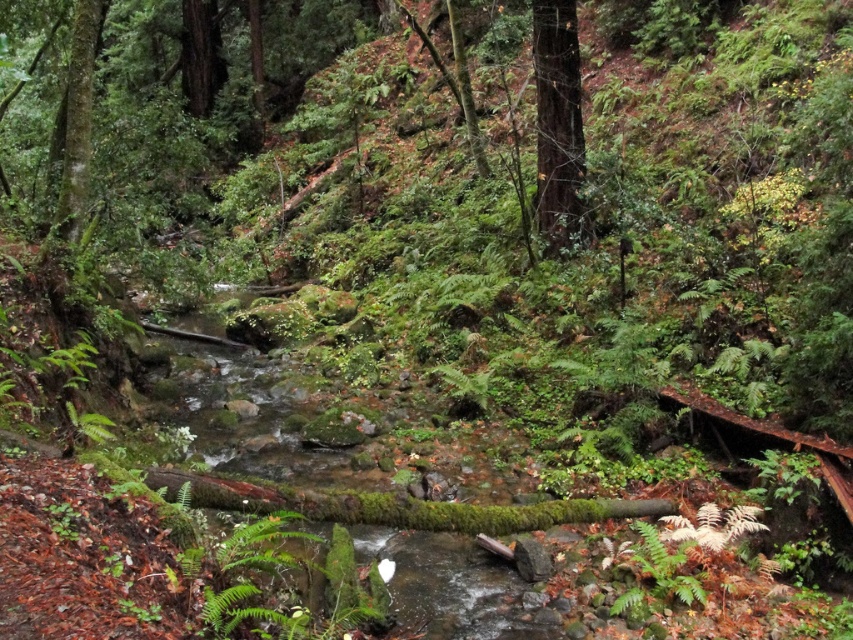
Question: Is green mossy tree at upper right positioned in front of green mossy tree at left?

Choices:
 (A) no
 (B) yes

Answer: (A)

Question: Where is green mossy tree at upper right located in relation to green mossy tree at left in the image?

Choices:
 (A) left
 (B) right

Answer: (B)

Question: Among these objects, which one is nearest to the camera?

Choices:
 (A) green mossy tree at upper right
 (B) green mossy tree at left

Answer: (B)

Question: Does green mossy tree at upper right have a larger size compared to green mossy tree at left?

Choices:
 (A) no
 (B) yes

Answer: (B)

Question: Which point appears farthest from the camera in this image?

Choices:
 (A) (556, 212)
 (B) (79, 218)

Answer: (A)